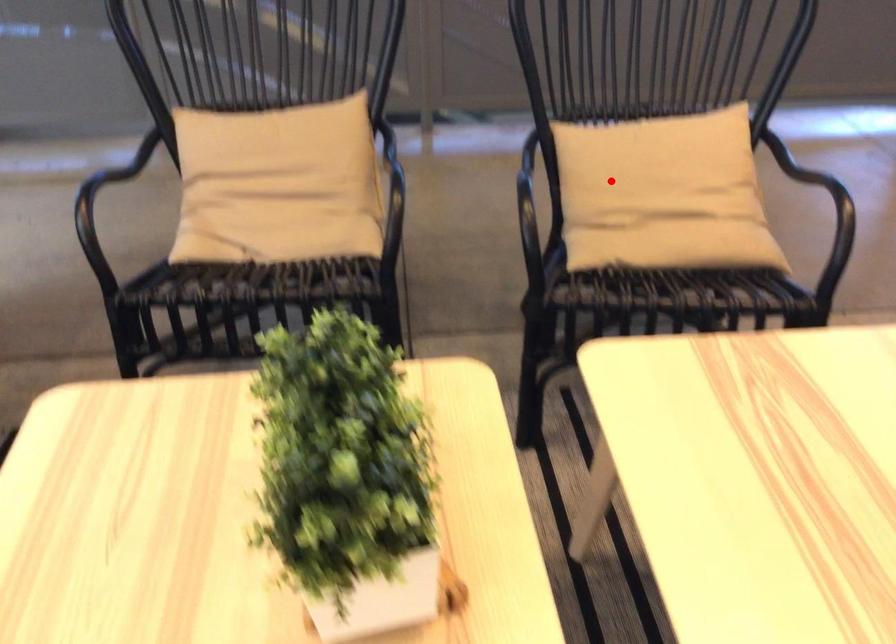
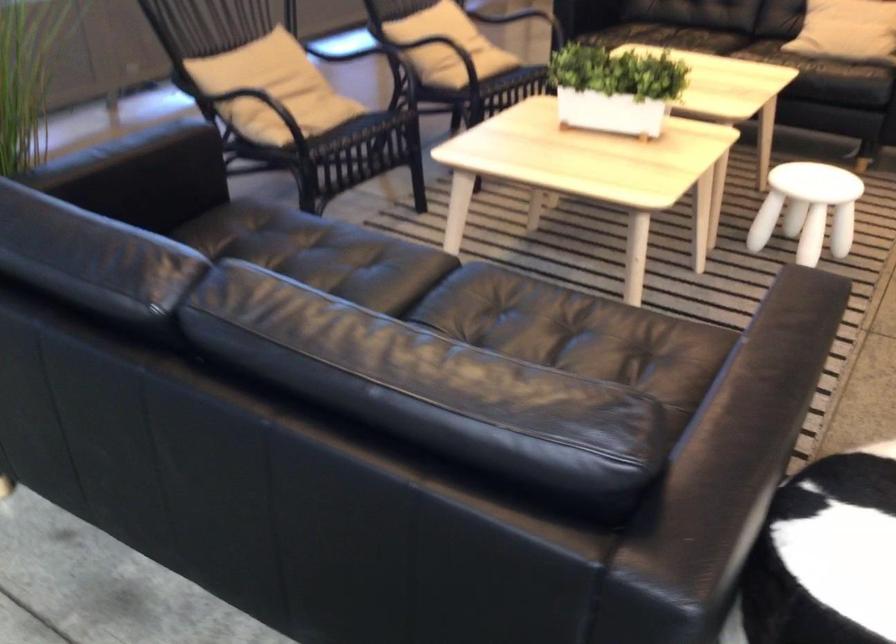
Question: I am providing you with two images of the same scene from different viewpoints. In image1, a red point is highlighted. Considering the same 3D point in image2, which of the following is correct?

Choices:
 (A) It is closer
 (B) It is farther

Answer: (B)